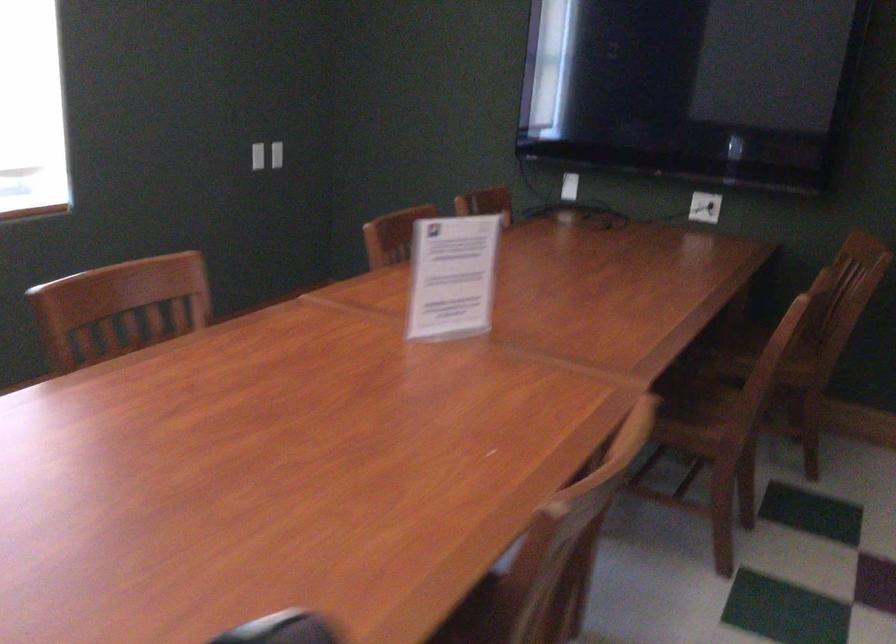
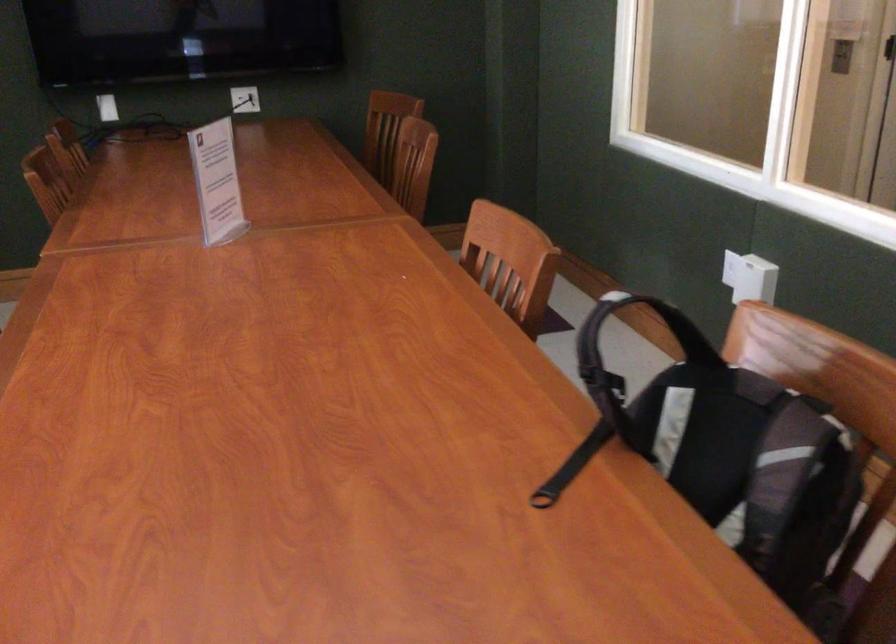
Question: The images are taken continuously from a first-person perspective. In which direction is your viewpoint rotating?

Choices:
 (A) Left
 (B) Right
 (C) Up
 (D) Down

Answer: (B)